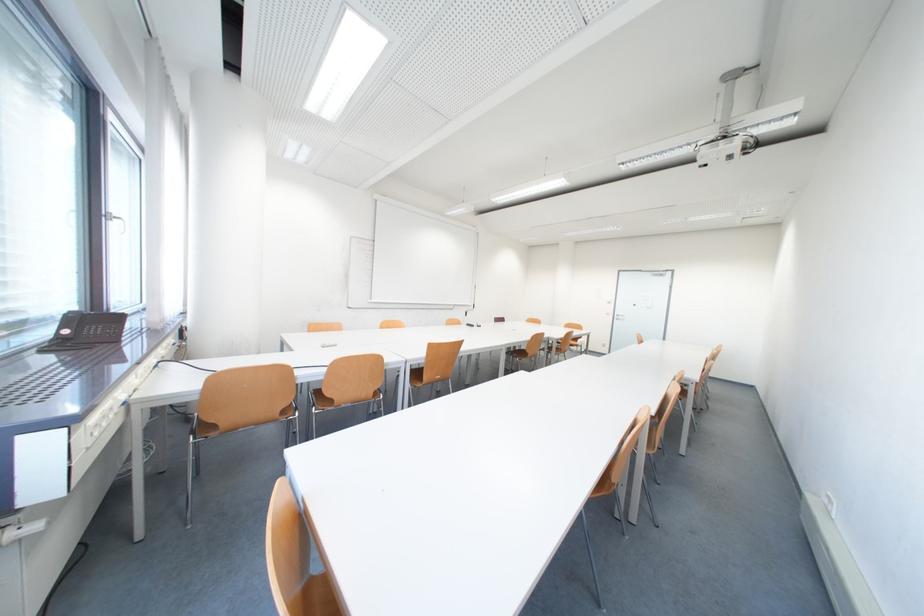
At what (x,y) coordinates should I click in order to perform the action: click on black phone handset. Please return your answer as a coordinate pair (x, y). The image size is (924, 616). Looking at the image, I should click on (67, 326).